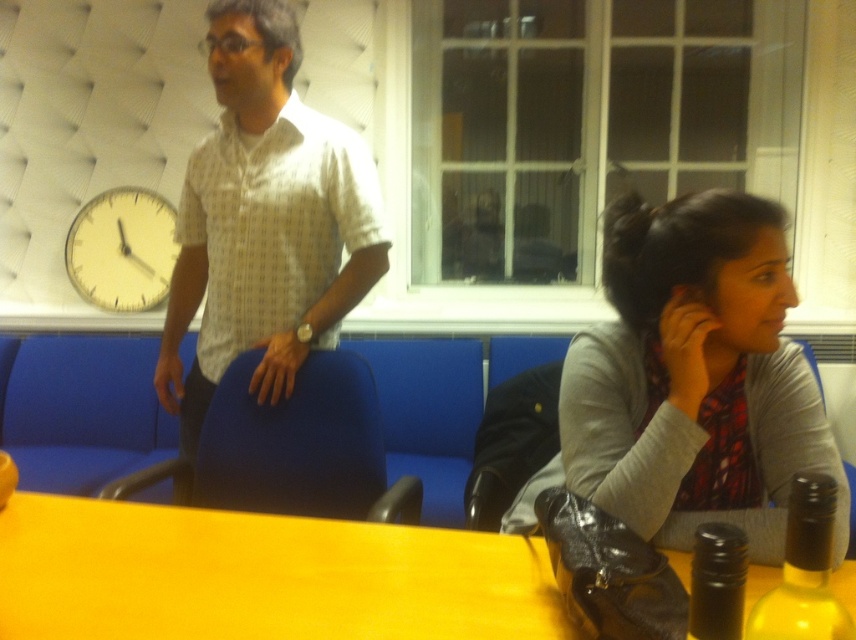
You are standing in the room and want to hand a document to both people. The gray fabric shirt at lower right is under the white dotted shirt at center. Which person should you approach first to ensure you can reach them without moving the other?

You should approach the white dotted shirt at center first because the gray fabric shirt at lower right is positioned under it, meaning the white dotted shirt at center is closer to you and easier to reach without disturbing the other person.

You are standing in the meeting room and notice the gray fabric shirt at lower right and the yellow matte clock at upper left. Which object is located lower in the frame?

The gray fabric shirt at lower right is positioned under the yellow matte clock at upper left, so it is located lower in the frame.

You are standing in the room and want to touch the point at coordinates (694, 378). Which object should you reach for?

The point at coordinates (694, 378) is on the gray fabric shirt at lower right, so you should reach for the gray fabric shirt at lower right.